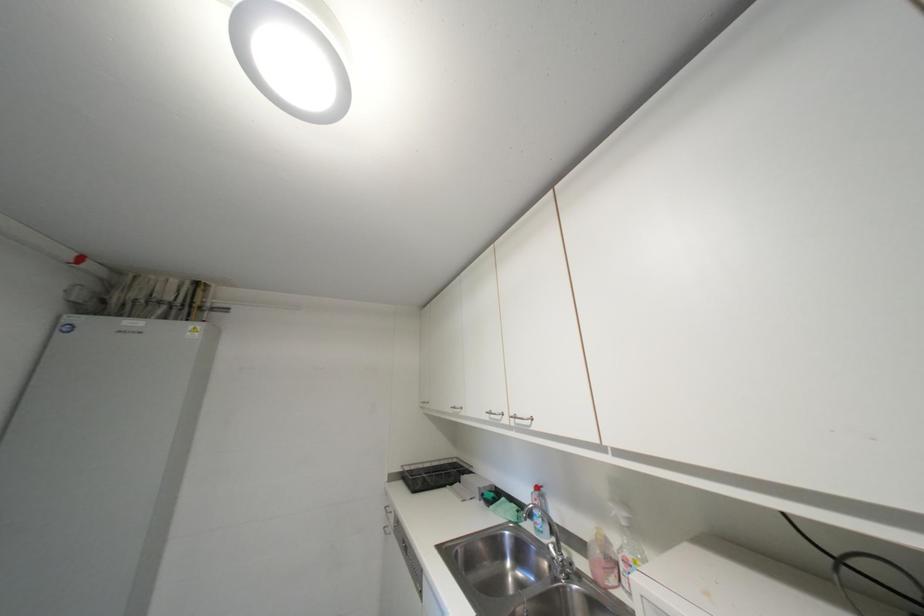
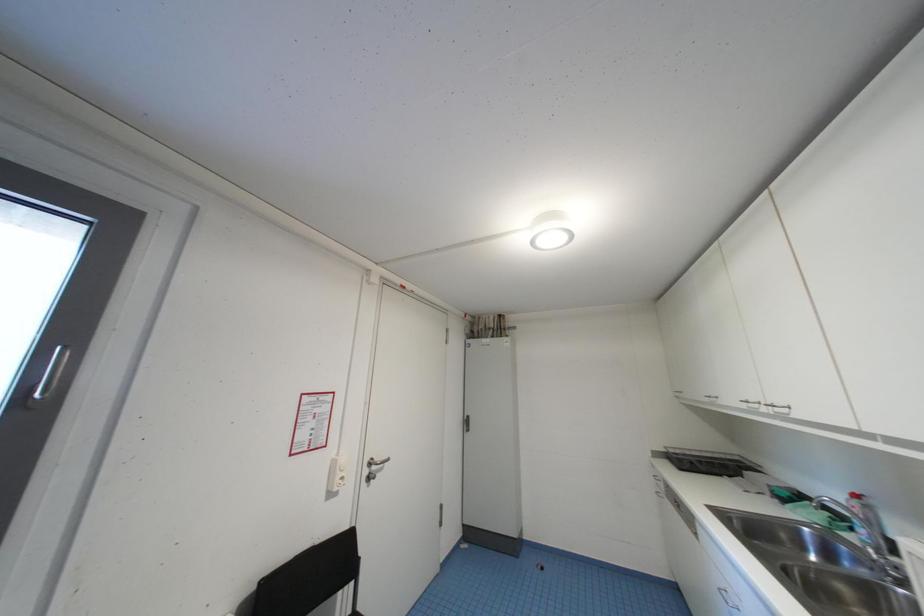
Question: The camera is either moving clockwise (left) or counter-clockwise (right) around the object. The first image is from the beginning of the video and the second image is from the end. Is the camera moving left or right when shooting the video?

Choices:
 (A) Left
 (B) Right

Answer: (B)